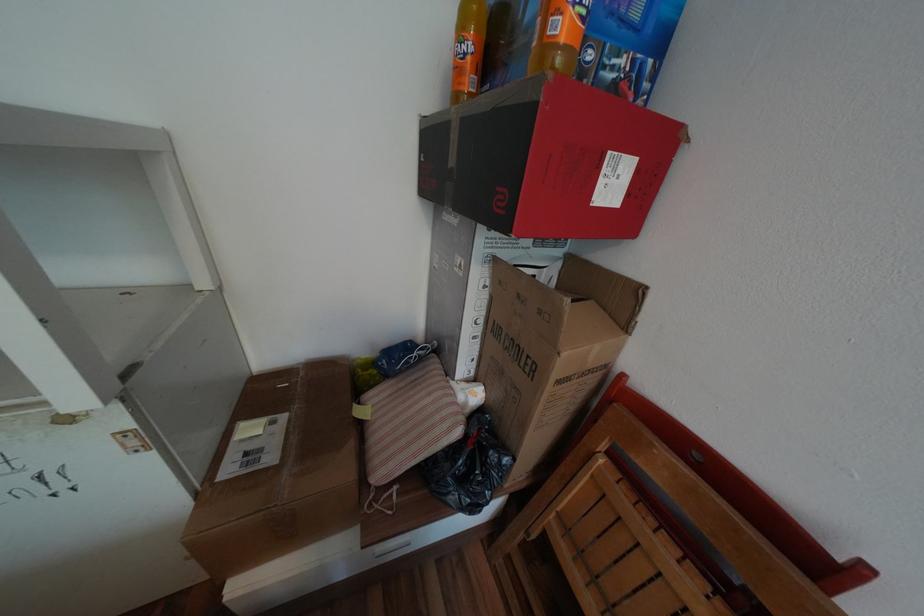
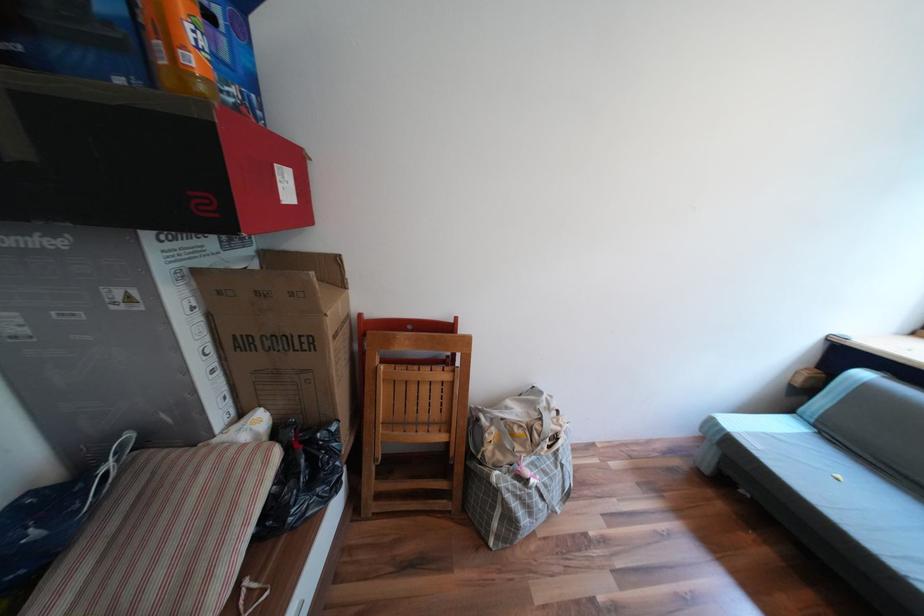
Locate, in the second image, the point that corresponds to (490,321) in the first image.

(219, 349)